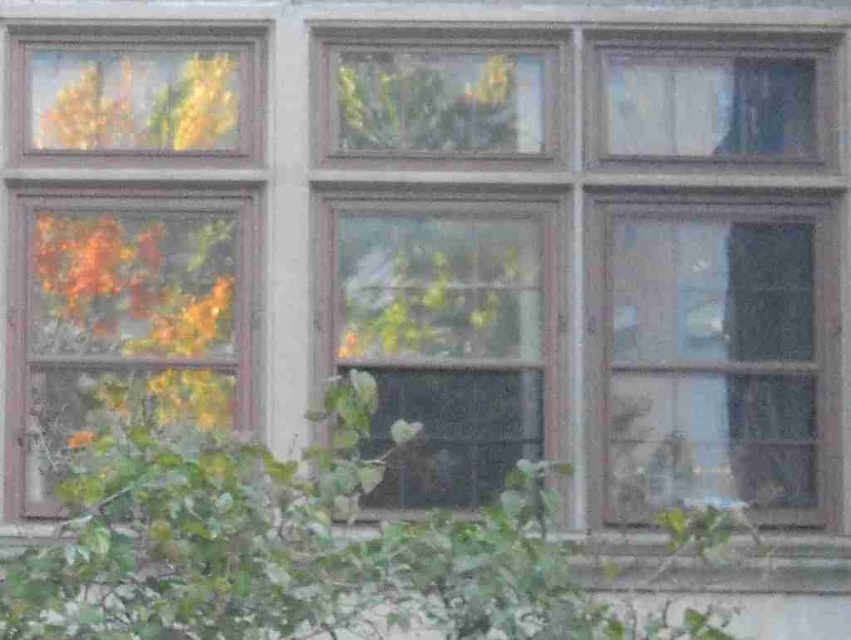
Question: Which point appears farthest from the camera in this image?

Choices:
 (A) (383, 248)
 (B) (615, 509)
 (C) (75, 294)
 (D) (483, 60)

Answer: (D)

Question: Based on their relative distances, which object is farther from the clear glass window at center?

Choices:
 (A) wooden window at left
 (B) transparent glass window at center
 (C) green leafy tree at center
 (D) transparent glass window at right

Answer: (C)

Question: Can you confirm if wooden window at left is smaller than clear glass window at center?

Choices:
 (A) yes
 (B) no

Answer: (B)

Question: From the image, what is the correct spatial relationship of green leafy tree at center in relation to wooden window at left?

Choices:
 (A) above
 (B) below

Answer: (B)

Question: Which of the following is the closest to the observer?

Choices:
 (A) (661, 609)
 (B) (646, 452)
 (C) (441, 413)
 (D) (488, 144)

Answer: (A)

Question: Considering the relative positions of green leafy tree at center and transparent glass window at right in the image provided, where is green leafy tree at center located with respect to transparent glass window at right?

Choices:
 (A) left
 (B) right

Answer: (A)